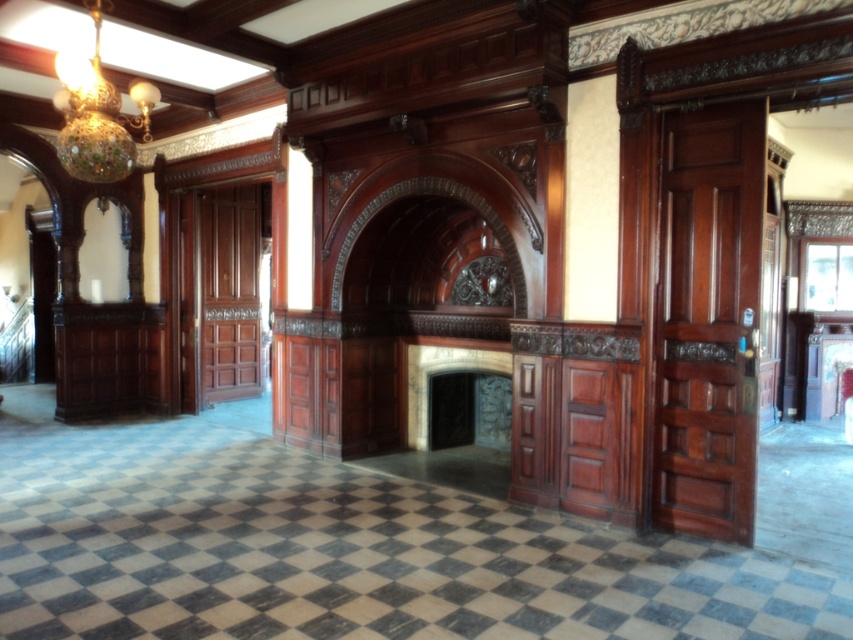
Can you confirm if multicolored glass chandelier at upper left is taller than dark stone fireplace at center?

In fact, multicolored glass chandelier at upper left may be shorter than dark stone fireplace at center.

Who is more forward, [97,141] or [410,440]?

Point [97,141] is more forward.

Who is more forward, (99, 68) or (442, 348)?

Positioned in front is point (99, 68).

Locate an element on the screen. multicolored glass chandelier at upper left is located at coordinates (97, 113).